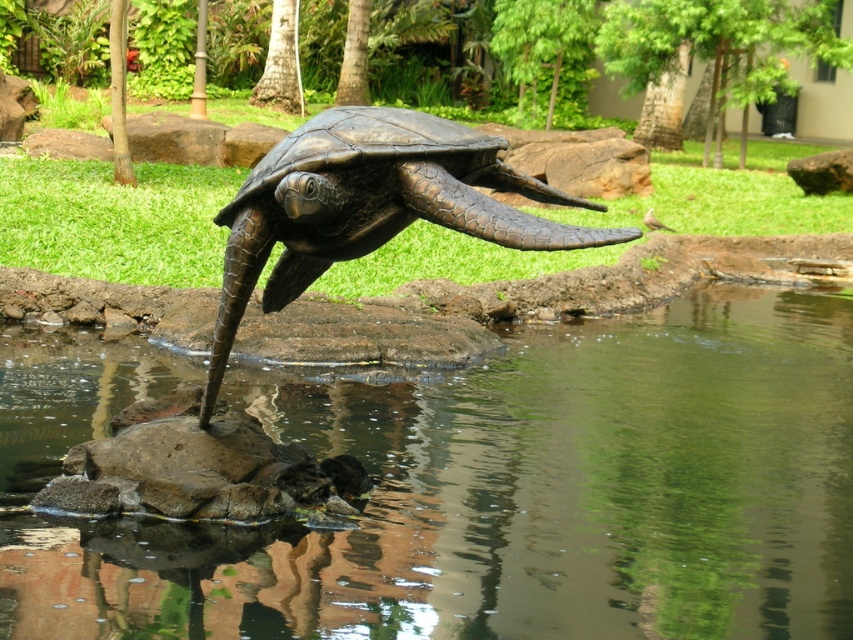
Question: Which point appears farthest from the camera in this image?

Choices:
 (A) (262, 218)
 (B) (36, 548)

Answer: (A)

Question: Is transparent water at rock center below bronze textured tortoise at center?

Choices:
 (A) yes
 (B) no

Answer: (A)

Question: Does transparent water at rock center appear on the right side of bronze textured tortoise at center?

Choices:
 (A) no
 (B) yes

Answer: (A)

Question: Does transparent water at rock center have a larger size compared to bronze textured tortoise at center?

Choices:
 (A) no
 (B) yes

Answer: (B)